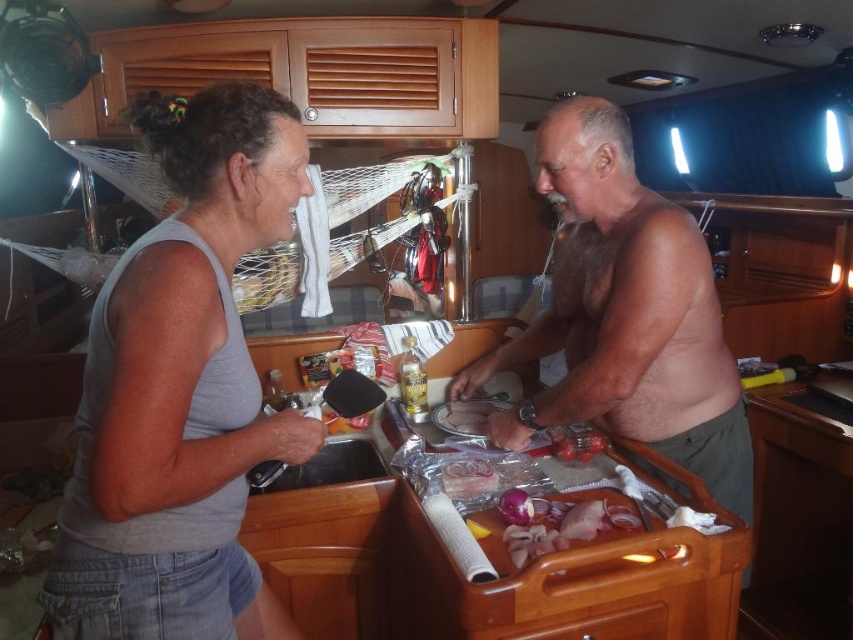
Is the position of gray cotton tank top at left less distant than that of shiny silver knife at center?

Yes, gray cotton tank top at left is closer to the viewer.

Is gray cotton tank top at left further to camera compared to shiny silver knife at center?

No, it is not.

This screenshot has width=853, height=640. Identify the location of gray cotton tank top at left. (181, 388).

Between shiny silver knife at center and translucent plastic bag at center, which one has more height?

Standing taller between the two is shiny silver knife at center.

Who is more distant from viewer, (730, 449) or (474, 410)?

Point (474, 410)

Who is more distant from viewer, (570,410) or (471,417)?

The point (471,417) is behind.

Find the location of `shiny silver knife at center`. shiny silver knife at center is located at coordinates (625, 314).

Who is shorter, gray cotton tank top at left or black plastic sink at lower left?

With less height is black plastic sink at lower left.

Which is in front, point (186, 483) or point (326, 420)?

Point (186, 483)

Where is `gray cotton tank top at left`? The height and width of the screenshot is (640, 853). gray cotton tank top at left is located at coordinates (181, 388).